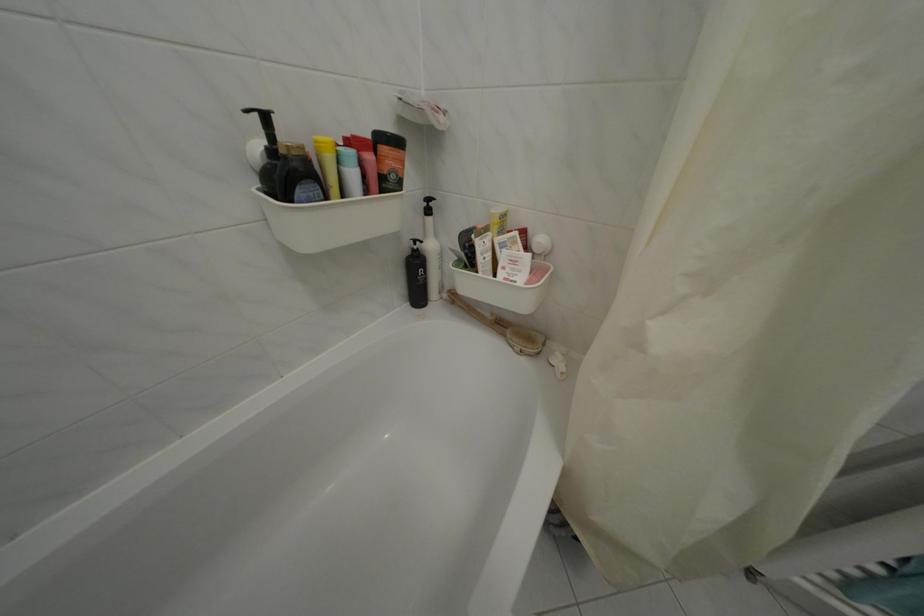
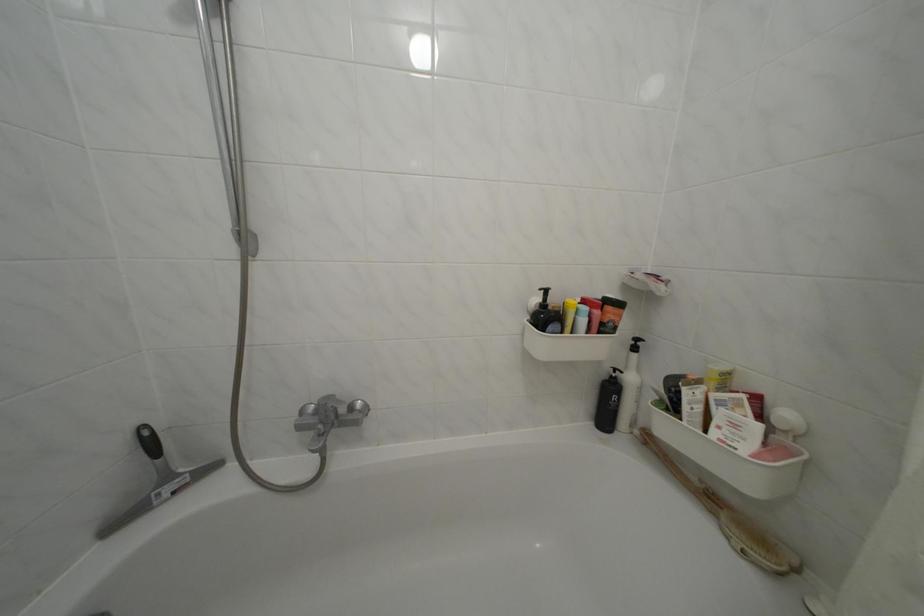
Where in the second image is the point corresponding to [302,159] from the first image?

(565, 315)